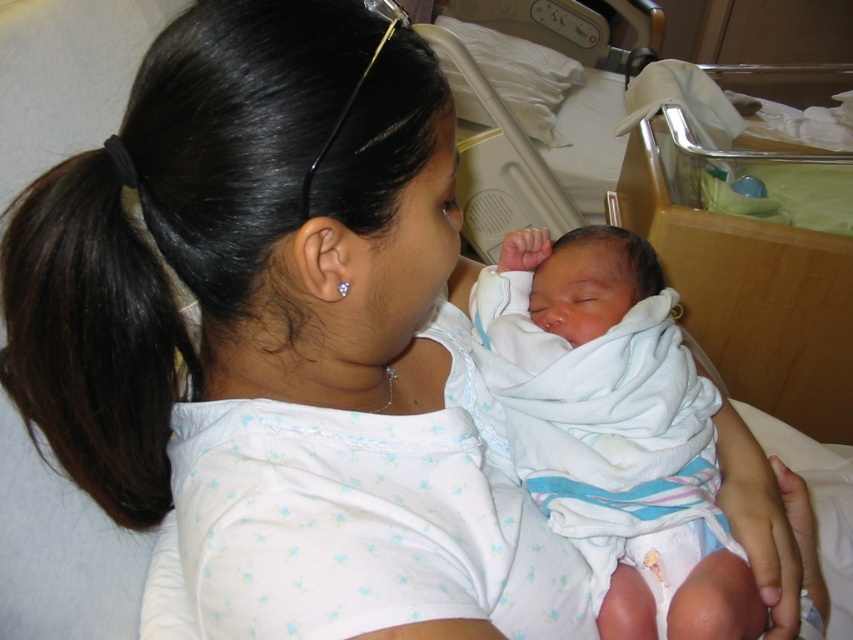
Which of these two, white soft swaddled newborn at center or dark brown hair at upper left, stands shorter?

dark brown hair at upper left

Describe the element at coordinates (614, 429) in the screenshot. I see `white soft swaddled newborn at center` at that location.

Find the location of a particular element. This screenshot has height=640, width=853. white soft swaddled newborn at center is located at coordinates (614, 429).